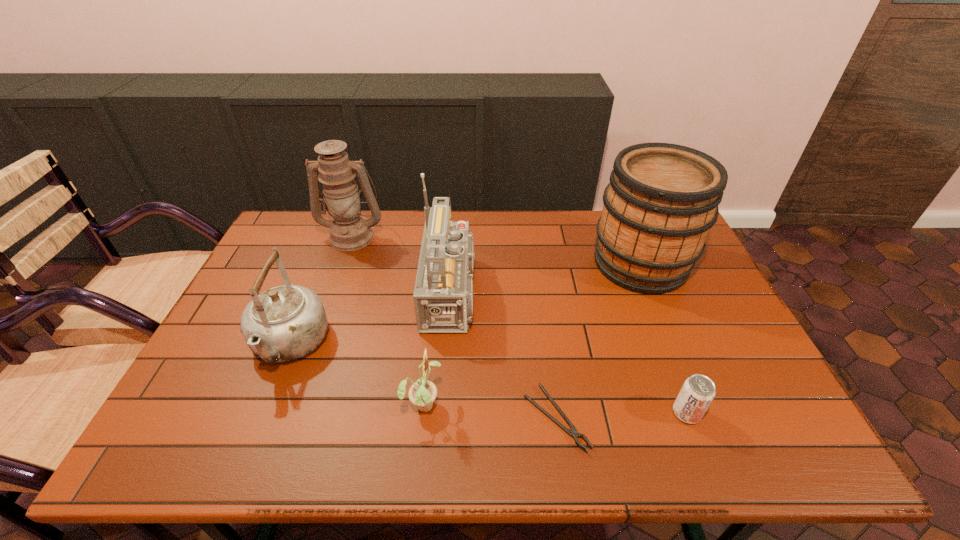
At what (x,y) coordinates should I click in order to perform the action: click on vacant space that satisfies the following two spatial constraints: 1. on the front-facing side of the radio receiver; 2. on the right side of the third object from right to left. Please return your answer as a coordinate pair (x, y). The image size is (960, 540). Looking at the image, I should click on (451, 418).

Where is `free space that satisfies the following two spatial constraints: 1. on the front-facing side of the third shortest object; 2. on the right side of the soda can`? free space that satisfies the following two spatial constraints: 1. on the front-facing side of the third shortest object; 2. on the right side of the soda can is located at coordinates (422, 413).

I want to click on vacant area in the image that satisfies the following two spatial constraints: 1. on the front-facing side of the fifth object from left to right; 2. on the right side of the radio receiver, so click(x=451, y=418).

Identify the location of vacant space that satisfies the following two spatial constraints: 1. on the front-facing side of the radio receiver; 2. at the spout of the kettle. This screenshot has height=540, width=960. (455, 345).

The height and width of the screenshot is (540, 960). I want to click on free region that satisfies the following two spatial constraints: 1. on the front-facing side of the radio receiver; 2. on the left side of the second shortest object, so click(451, 413).